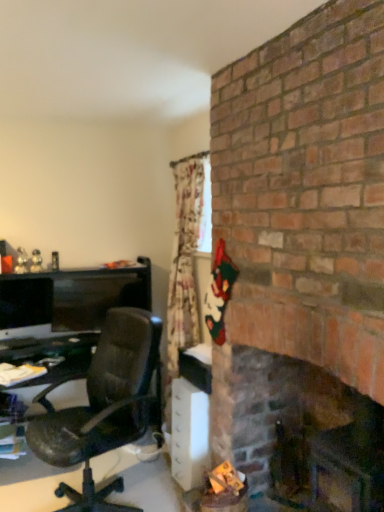
At what (x,y) coordinates should I click in order to perform the action: click on dark brown wood fireplace at right. Please return your answer as a coordinate pair (x, y). The image size is (384, 512). Looking at the image, I should click on (305, 431).

From a real-world perspective, which is physically above, dark brown wood fireplace at right or white plastic/file cabinet at lower center?

From a 3D spatial view, dark brown wood fireplace at right is above.

How many degrees apart are the facing directions of dark brown wood fireplace at right and white plastic/file cabinet at lower center?

The angle between the facing direction of dark brown wood fireplace at right and the facing direction of white plastic/file cabinet at lower center is 2.1 degrees.

Can you confirm if dark brown wood fireplace at right is shorter than white plastic/file cabinet at lower center?

In fact, dark brown wood fireplace at right may be taller than white plastic/file cabinet at lower center.

Is dark brown wood fireplace at right situated inside white plastic/file cabinet at lower center or outside?

dark brown wood fireplace at right is not inside white plastic/file cabinet at lower center, it's outside.

Is dark brown wood fireplace at right to the left of matte black monitor at left from the viewer's perspective?

Incorrect, dark brown wood fireplace at right is not on the left side of matte black monitor at left.

Are dark brown wood fireplace at right and matte black monitor at left located far from each other?

That's right, there is a large distance between dark brown wood fireplace at right and matte black monitor at left.

From the image's perspective, who appears lower, dark brown wood fireplace at right or matte black monitor at left?

dark brown wood fireplace at right, from the image's perspective.

Can you confirm if dark brown wood fireplace at right is taller than matte black monitor at left?

Correct, dark brown wood fireplace at right is much taller as matte black monitor at left.

Are matte black monitor at left and white plastic/file cabinet at lower center beside each other?

No, matte black monitor at left is not next to white plastic/file cabinet at lower center.

From the image's perspective, which is below, matte black monitor at left or white plastic/file cabinet at lower center?

white plastic/file cabinet at lower center, from the image's perspective.

From the picture: Is matte black monitor at left to the left or to the right of white plastic/file cabinet at lower center in the image?

matte black monitor at left is positioned on white plastic/file cabinet at lower center's left side.

Is white plastic/file cabinet at lower center not close to dark brown wood fireplace at right?

No, there isn't a large distance between white plastic/file cabinet at lower center and dark brown wood fireplace at right.

Is white plastic/file cabinet at lower center aimed at dark brown wood fireplace at right?

No, white plastic/file cabinet at lower center is not oriented towards dark brown wood fireplace at right.

Considering the sizes of objects white plastic/file cabinet at lower center and dark brown wood fireplace at right in the image provided, who is taller, white plastic/file cabinet at lower center or dark brown wood fireplace at right?

With more height is dark brown wood fireplace at right.

Which is in front, point (200, 460) or point (231, 379)?

Positioned in front is point (231, 379).

I want to click on computer monitor on the left side of white plastic/file cabinet at lower center, so 25,307.

Considering the sizes of white plastic/file cabinet at lower center and matte black monitor at left in the image, is white plastic/file cabinet at lower center wider or thinner than matte black monitor at left?

In the image, white plastic/file cabinet at lower center appears to be wider than matte black monitor at left.

Is white plastic/file cabinet at lower center inside or outside of matte black monitor at left?

white plastic/file cabinet at lower center is not inside matte black monitor at left, it's outside.

Is dark brown wood fireplace at right a part of matte black monitor at left?

No, dark brown wood fireplace at right is not surrounded by matte black monitor at left.

Is point (30, 298) behind point (359, 452)?

That is True.

Is matte black monitor at left at the left side of dark brown wood fireplace at right?

Yes.

Between matte black monitor at left and dark brown wood fireplace at right, which one has smaller size?

With smaller size is matte black monitor at left.

Image resolution: width=384 pixels, height=512 pixels. What are the coordinates of `fireplace that is in front of the white plastic/file cabinet at lower center` in the screenshot? It's located at (305, 431).

Locate an element on the screen. fireplace on the right of matte black monitor at left is located at coordinates (305, 431).

Estimate the real-world distances between objects in this image. Which object is further from matte black monitor at left, white plastic/file cabinet at lower center or dark brown wood fireplace at right?

dark brown wood fireplace at right is positioned further to the anchor matte black monitor at left.

From the image, which object appears to be nearer to white plastic/file cabinet at lower center, matte black monitor at left or dark brown wood fireplace at right?

dark brown wood fireplace at right is closer to white plastic/file cabinet at lower center.

When comparing their distances from dark brown wood fireplace at right, does matte black monitor at left or white plastic/file cabinet at lower center seem further?

The object further to dark brown wood fireplace at right is matte black monitor at left.

From the image, which object appears to be nearer to white plastic/file cabinet at lower center, dark brown wood fireplace at right or matte black monitor at left?

Among the two, dark brown wood fireplace at right is located nearer to white plastic/file cabinet at lower center.

From the image, which object appears to be nearer to dark brown wood fireplace at right, white plastic/file cabinet at lower center or matte black monitor at left?

Based on the image, white plastic/file cabinet at lower center appears to be nearer to dark brown wood fireplace at right.

Looking at this image, when comparing their distances from matte black monitor at left, does dark brown wood fireplace at right or white plastic/file cabinet at lower center seem further?

Among the two, dark brown wood fireplace at right is located further to matte black monitor at left.

The height and width of the screenshot is (512, 384). I want to click on file cabinet between matte black monitor at left and dark brown wood fireplace at right in the horizontal direction, so click(x=189, y=434).